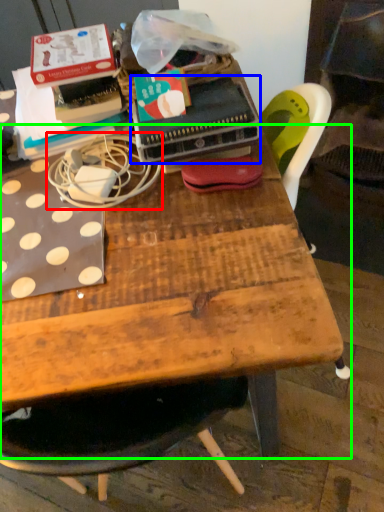
Question: Which is farther away from string (highlighted by a red box)? paperback book (highlighted by a blue box) or table (highlighted by a green box)?

Choices:
 (A) paperback book
 (B) table

Answer: (B)